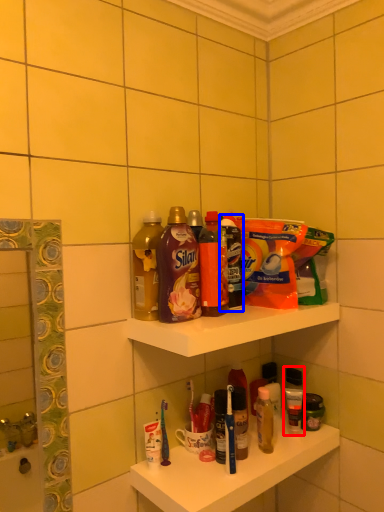
Question: Which object appears closest to the camera in this image, toiletry (highlighted by a red box) or cleaning product (highlighted by a blue box)?

Choices:
 (A) toiletry
 (B) cleaning product

Answer: (B)